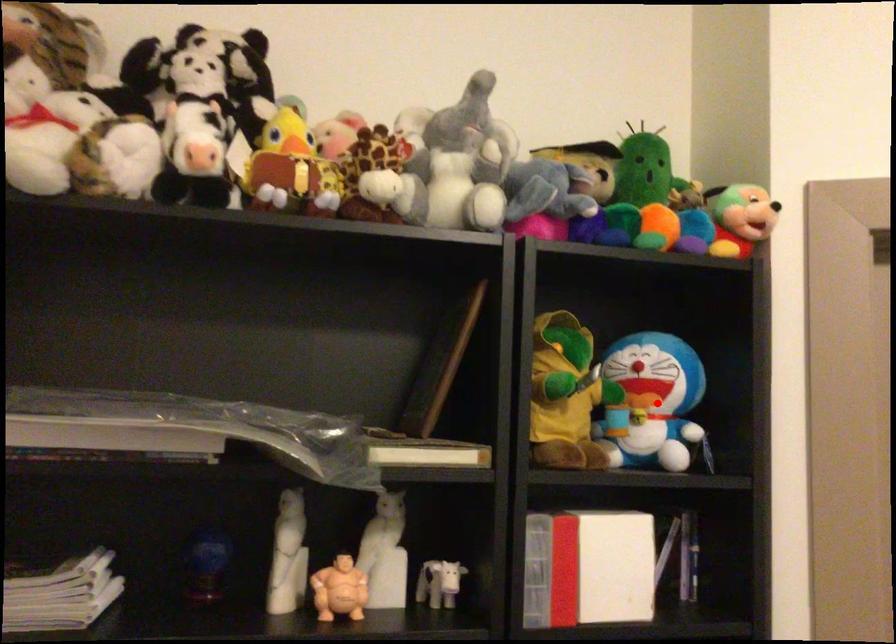
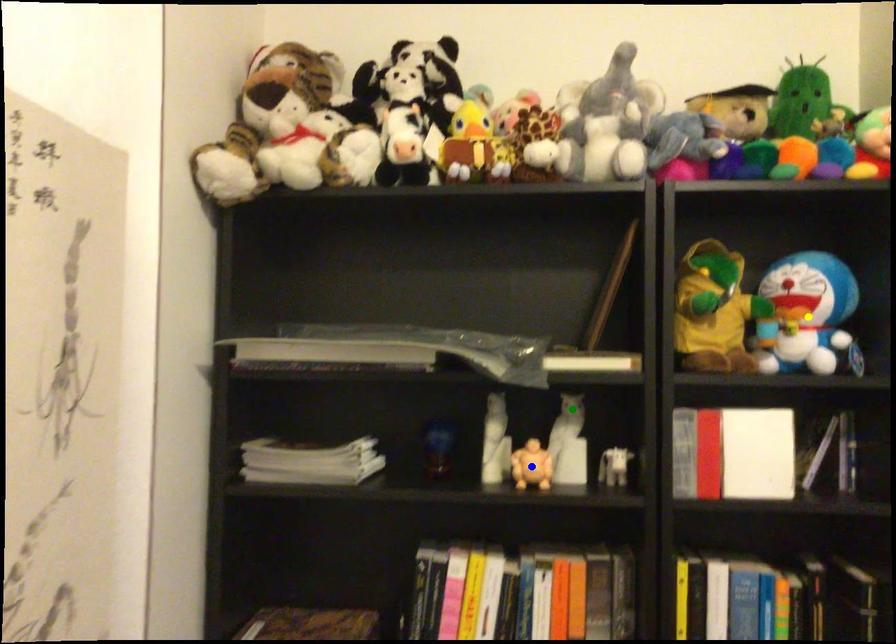
Question: I am providing you with two images of the same scene from different viewpoints. A red point is marked on the first image. You are given multiple points on the second image. Which point in image 2 represents the same 3d spot as the red point in image 1?

Choices:
 (A) green point
 (B) blue point
 (C) yellow point

Answer: (C)